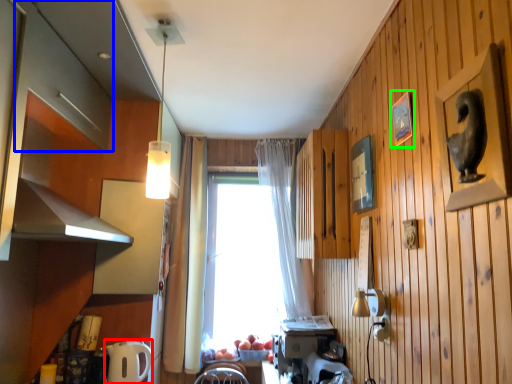
Question: Considering the real-world distances, which object is closest to appliance (highlighted by a red box)? cabinetry (highlighted by a blue box) or picture frame (highlighted by a green box).

Choices:
 (A) cabinetry
 (B) picture frame

Answer: (A)